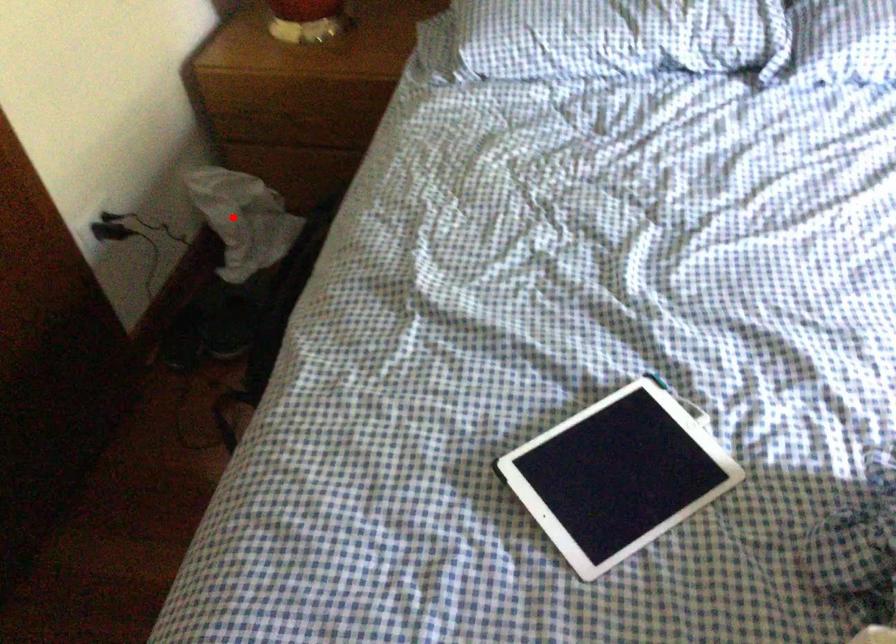
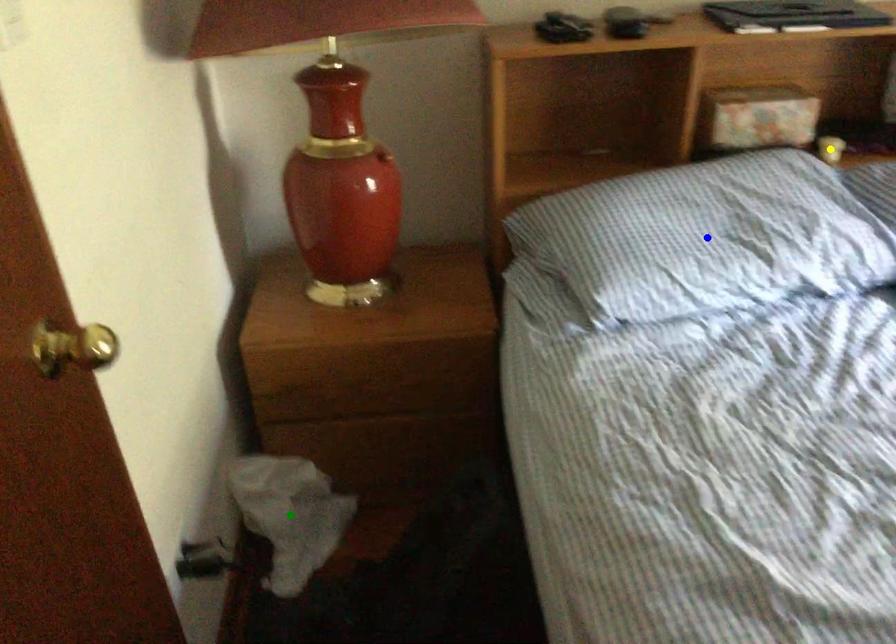
Question: I am providing you with two images of the same scene from different viewpoints. A red point is marked on the first image. You are given multiple points on the second image. In image 2, which mark is for the same physical point as the one in image 1?

Choices:
 (A) blue point
 (B) green point
 (C) yellow point

Answer: (B)